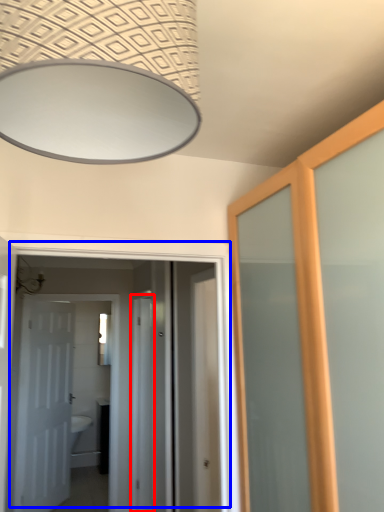
Question: Among these objects, which one is farthest to the camera, screen door (highlighted by a red box) or door (highlighted by a blue box)?

Choices:
 (A) screen door
 (B) door

Answer: (A)